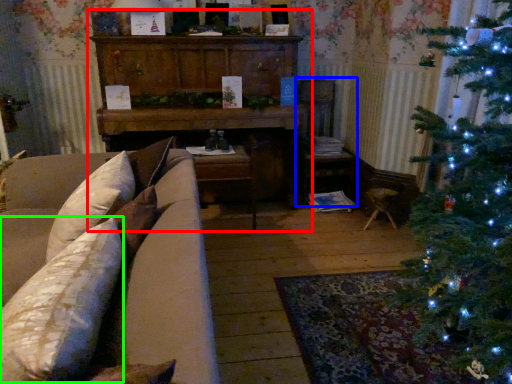
Question: Which object is the closest to the dresser (highlighted by a red box)? Choose among these: armchair (highlighted by a blue box) or pillow (highlighted by a green box).

Choices:
 (A) armchair
 (B) pillow

Answer: (A)